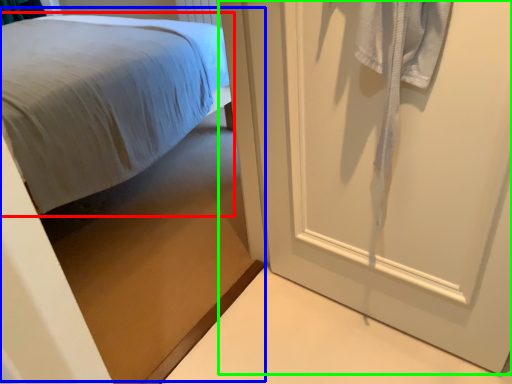
Question: Which is farther away from bed (highlighted by a red box)? bed (highlighted by a blue box) or door (highlighted by a green box)?

Choices:
 (A) bed
 (B) door

Answer: (B)